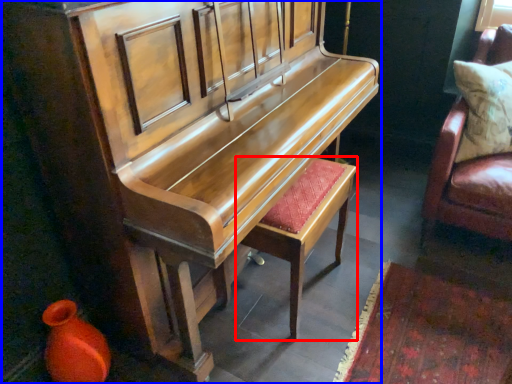
Question: Which of the following is the farthest to the observer, stool (highlighted by a red box) or furniture (highlighted by a blue box)?

Choices:
 (A) stool
 (B) furniture

Answer: (A)